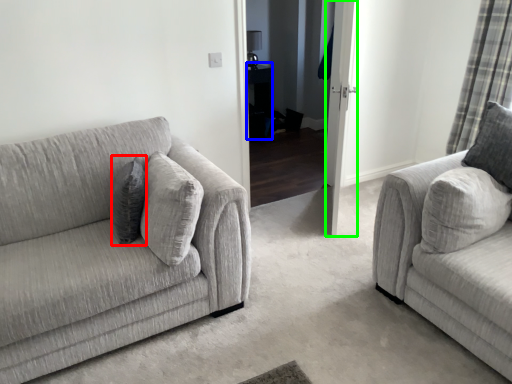
Question: Which object is the closest to the pillow (highlighted by a red box)? Choose among these: table (highlighted by a blue box) or glass door (highlighted by a green box).

Choices:
 (A) table
 (B) glass door

Answer: (B)